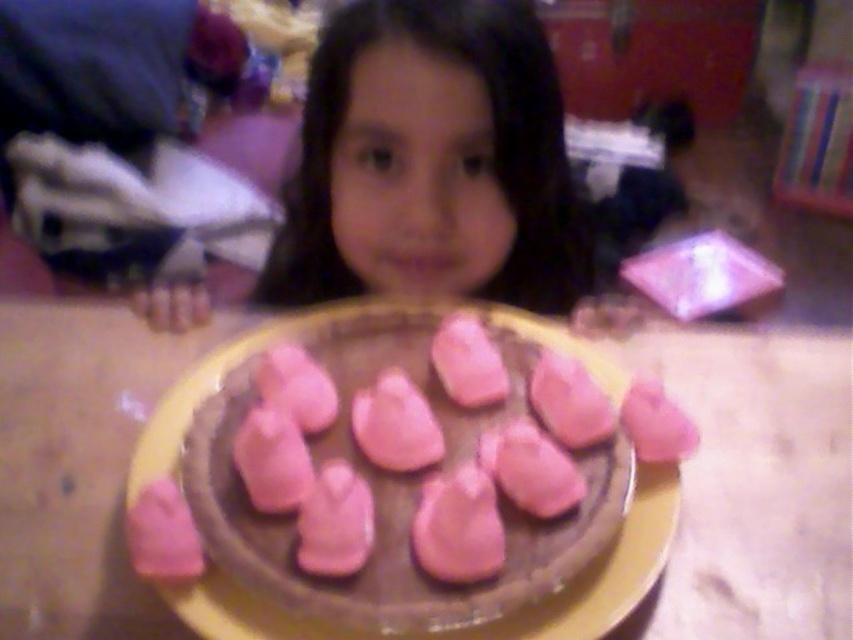
Question: Which point is farther from the camera taking this photo?

Choices:
 (A) (293, 525)
 (B) (646, 448)
 (C) (550, 198)

Answer: (C)

Question: From the image, what is the correct spatial relationship of smooth skin face at center in relation to pink matte chocolate cake at center?

Choices:
 (A) above
 (B) below

Answer: (A)

Question: Where is smooth skin face at center located in relation to pink matte chocolate cake at center in the image?

Choices:
 (A) below
 (B) above

Answer: (B)

Question: Which of the following is the farthest from the observer?

Choices:
 (A) pink matte chocolate cake at center
 (B) pink matte meringue at center
 (C) smooth skin face at center

Answer: (C)

Question: Which object is closer to the camera taking this photo?

Choices:
 (A) pink matte meringue at center
 (B) smooth skin face at center

Answer: (A)

Question: Does smooth skin face at center appear under pink matte meringue at center?

Choices:
 (A) yes
 (B) no

Answer: (B)